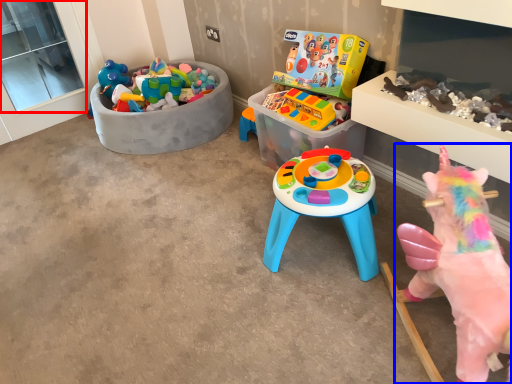
Question: Among these objects, which one is farthest to the camera, window screen (highlighted by a red box) or toy (highlighted by a blue box)?

Choices:
 (A) window screen
 (B) toy

Answer: (A)